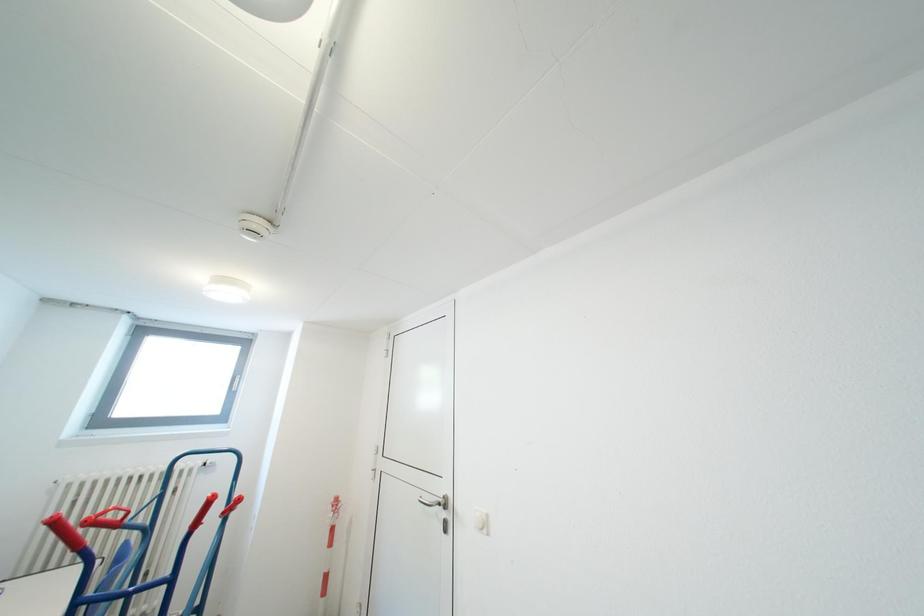
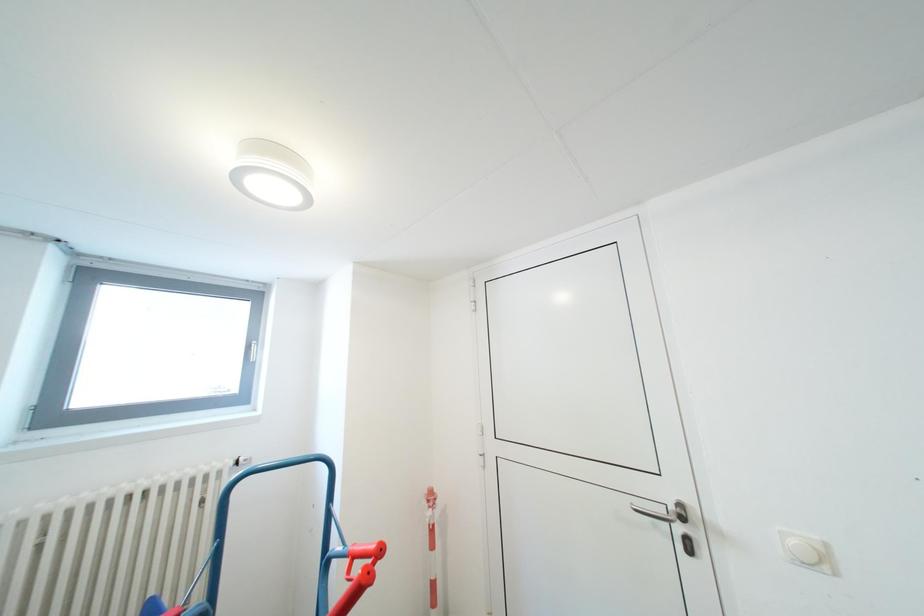
In a continuous first-person perspective shot, in which direction is the camera moving?

The movement direction of the cameraman is left, forward.